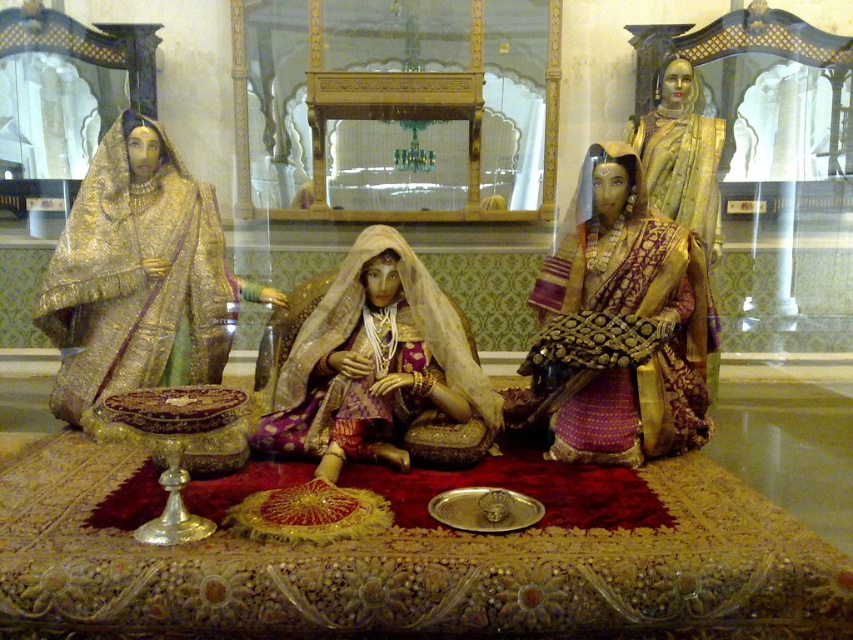
Is point (611, 278) closer to camera compared to point (119, 301)?

Yes, it is in front of point (119, 301).

Identify the location of gold silk saree at center. This screenshot has height=640, width=853. (619, 324).

Which is below, gold embroidered dress at left or gold silk saree at upper right?

Positioned lower is gold embroidered dress at left.

Who is taller, gold embroidered dress at left or gold silk saree at upper right?

With more height is gold embroidered dress at left.

Is point (155, 150) closer to viewer compared to point (700, 145)?

Yes, it is in front of point (700, 145).

Where is `gold embroidered dress at left`? The image size is (853, 640). gold embroidered dress at left is located at coordinates pos(138,276).

The height and width of the screenshot is (640, 853). I want to click on matte gold fabric at center, so click(x=370, y=362).

In order to click on matte gold fabric at center in this screenshot , I will do `click(370, 362)`.